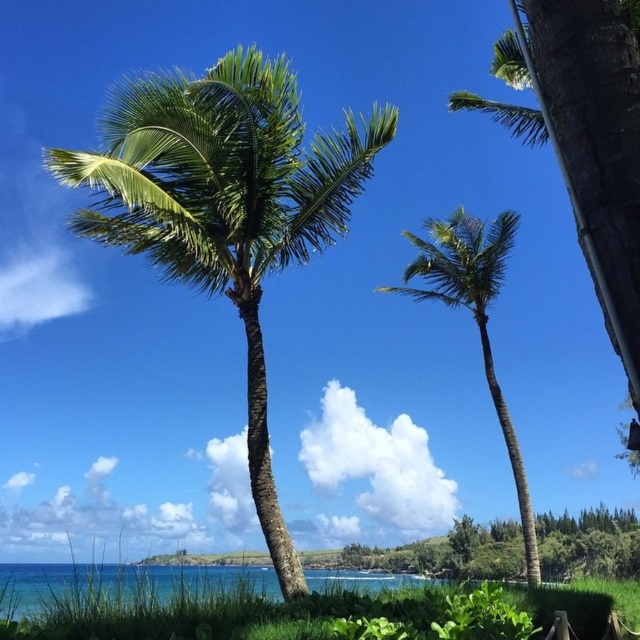
Who is shorter, green leafy coconut tree at center or green leafy palm tree at center?

Standing shorter between the two is green leafy palm tree at center.

From the picture: Can you confirm if green leafy coconut tree at center is wider than green leafy palm tree at center?

Yes.

Locate an element on the screen. The width and height of the screenshot is (640, 640). green leafy coconut tree at center is located at coordinates (225, 205).

Can you confirm if green leafy coconut tree at center is positioned below clear blue water at lower left?

Actually, green leafy coconut tree at center is above clear blue water at lower left.

Measure the distance between point (195, 280) and camera.

Point (195, 280) and camera are 31.57 feet apart from each other.

Where is `green leafy coconut tree at center`? The height and width of the screenshot is (640, 640). green leafy coconut tree at center is located at coordinates (225, 205).

Based on the photo, can you confirm if clear blue water at lower left is thinner than green leafy palm tree at center?

In fact, clear blue water at lower left might be wider than green leafy palm tree at center.

Based on the photo, measure the distance between clear blue water at lower left and green leafy palm tree at center.

clear blue water at lower left is 19.16 meters away from green leafy palm tree at center.

Find the location of a particular element. The image size is (640, 640). clear blue water at lower left is located at coordinates (120, 582).

Locate an element on the screen. clear blue water at lower left is located at coordinates (120, 582).